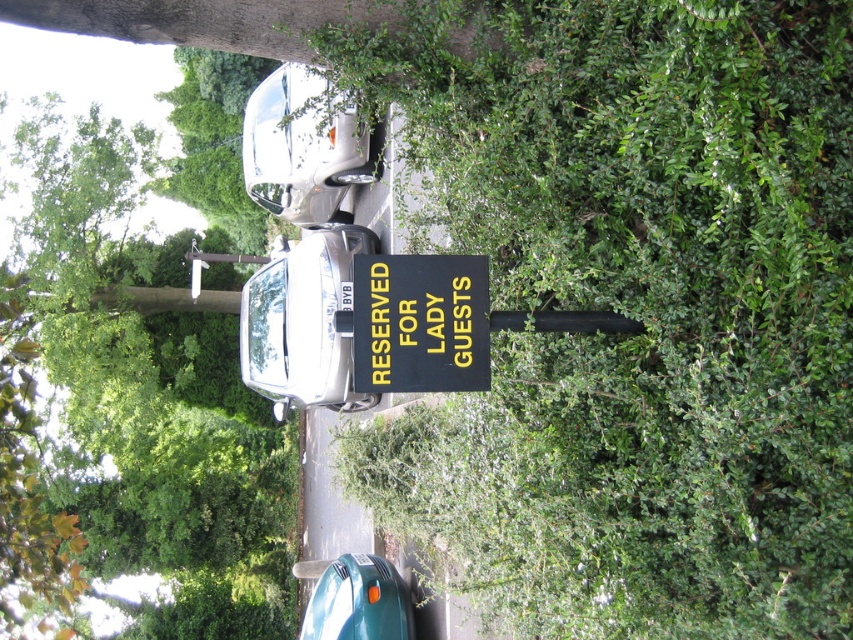
You are standing in the parking area and see the point at coordinates (421, 323). Which object in the scene does this point belong to?

The point at coordinates (421, 323) belongs to the black and yellow plastic sign at center.

Looking at this image, you are a parking attendant who needs to fit a new car that is 1.8 meters wide into the parking area. You observe the satin silver car at center and the silver metallic car at upper center. Which parking spot between these two cars can accommodate the new car based on their widths?

The satin silver car at center has a larger width than the silver metallic car at upper center. Therefore, the parking spot next to the satin silver car at center can accommodate the new car since it has more space available.